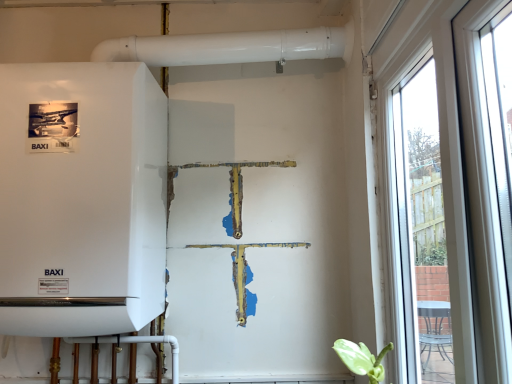
Question: Is transparent glass window at right completely or partially inside white matte boiler at left?

Choices:
 (A) no
 (B) yes

Answer: (A)

Question: Can you confirm if white matte boiler at left is smaller than transparent glass window at right?

Choices:
 (A) yes
 (B) no

Answer: (B)

Question: Can you confirm if white matte boiler at left is wider than transparent glass window at right?

Choices:
 (A) no
 (B) yes

Answer: (B)

Question: Considering the relative sizes of white matte boiler at left and transparent glass window at right in the image provided, is white matte boiler at left thinner than transparent glass window at right?

Choices:
 (A) yes
 (B) no

Answer: (B)

Question: Can you confirm if white matte boiler at left is bigger than transparent glass window at right?

Choices:
 (A) yes
 (B) no

Answer: (A)

Question: Considering the relative sizes of white matte boiler at left and transparent glass window at right in the image provided, is white matte boiler at left shorter than transparent glass window at right?

Choices:
 (A) yes
 (B) no

Answer: (A)

Question: From a real-world perspective, is transparent glass window at right below white matte boiler at left?

Choices:
 (A) yes
 (B) no

Answer: (A)

Question: From the image's perspective, is transparent glass window at right on top of white matte boiler at left?

Choices:
 (A) yes
 (B) no

Answer: (B)

Question: Can you confirm if transparent glass window at right is thinner than white matte boiler at left?

Choices:
 (A) no
 (B) yes

Answer: (B)

Question: Can you confirm if transparent glass window at right is shorter than white matte boiler at left?

Choices:
 (A) yes
 (B) no

Answer: (B)

Question: Is transparent glass window at right to the left of white matte boiler at left from the viewer's perspective?

Choices:
 (A) no
 (B) yes

Answer: (A)

Question: Can you confirm if transparent glass window at right is bigger than white matte boiler at left?

Choices:
 (A) no
 (B) yes

Answer: (A)

Question: Does point (485, 18) appear closer or farther from the camera than point (96, 327)?

Choices:
 (A) closer
 (B) farther

Answer: (A)